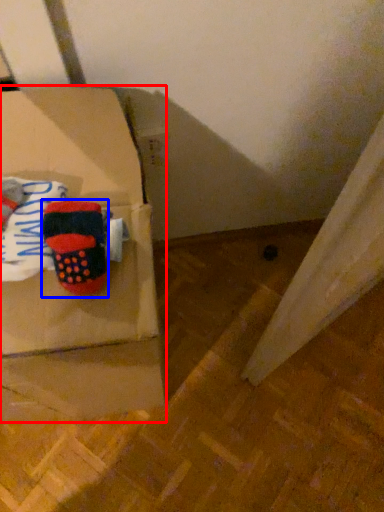
Question: Which point is further to the camera, box (highlighted by a red box) or footwear (highlighted by a blue box)?

Choices:
 (A) box
 (B) footwear

Answer: (B)